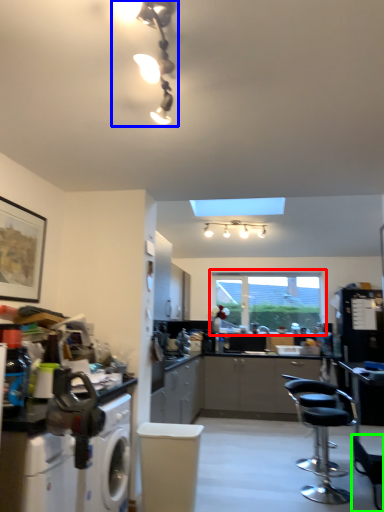
Question: Which object is positioned closest to window (highlighted by a red box)? Select from light fixture (highlighted by a blue box) and chair (highlighted by a green box).

Choices:
 (A) light fixture
 (B) chair

Answer: (B)